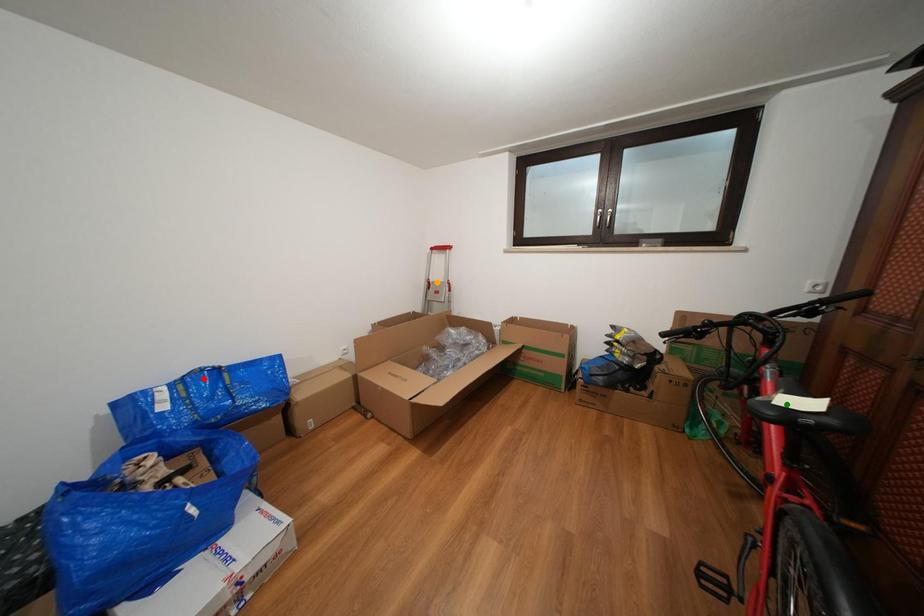
Order these from nearest to farthest:
orange point
green point
red point

green point, red point, orange point